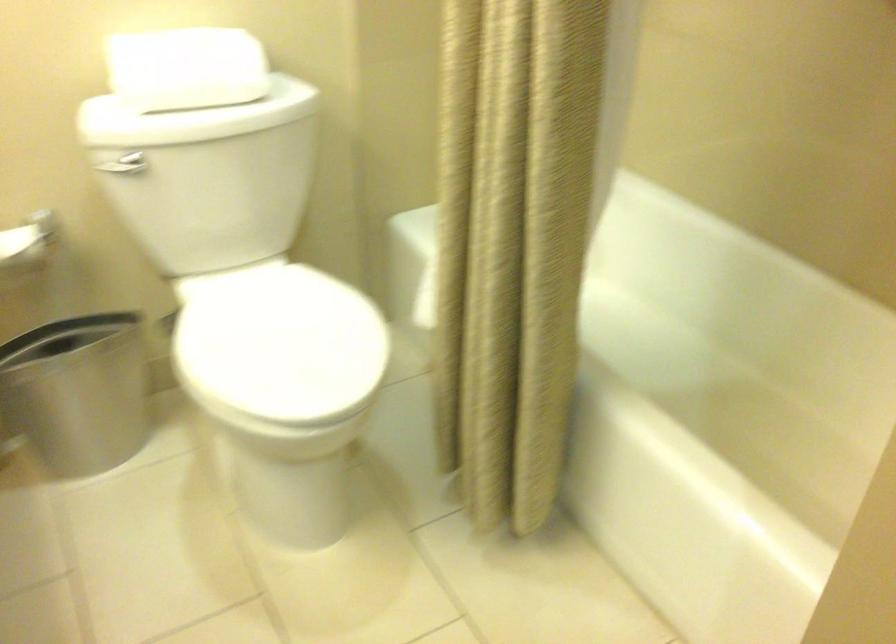
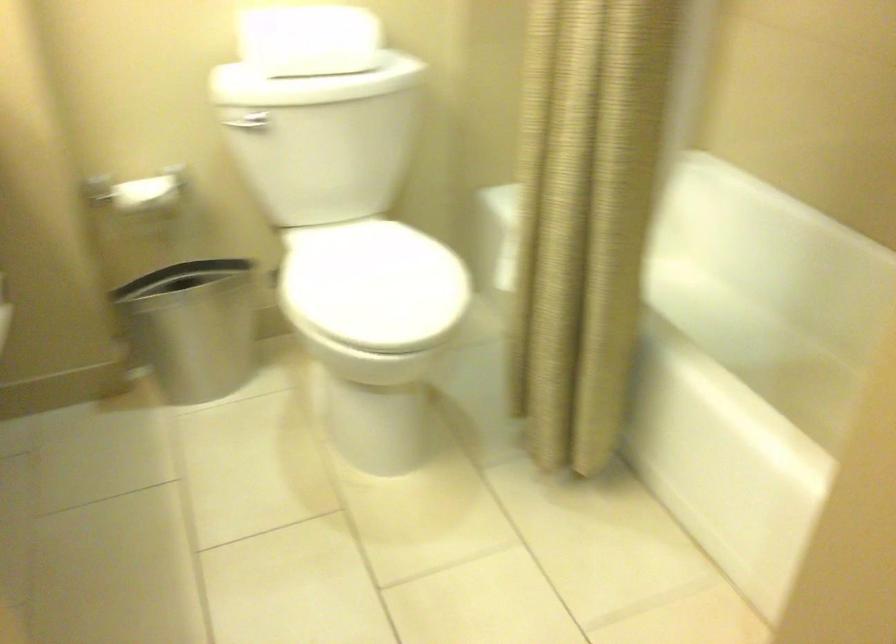
Question: The first image is from the beginning of the video and the second image is from the end. How did the camera likely rotate when shooting the video?

Choices:
 (A) Left
 (B) Right
 (C) Up
 (D) Down

Answer: (A)